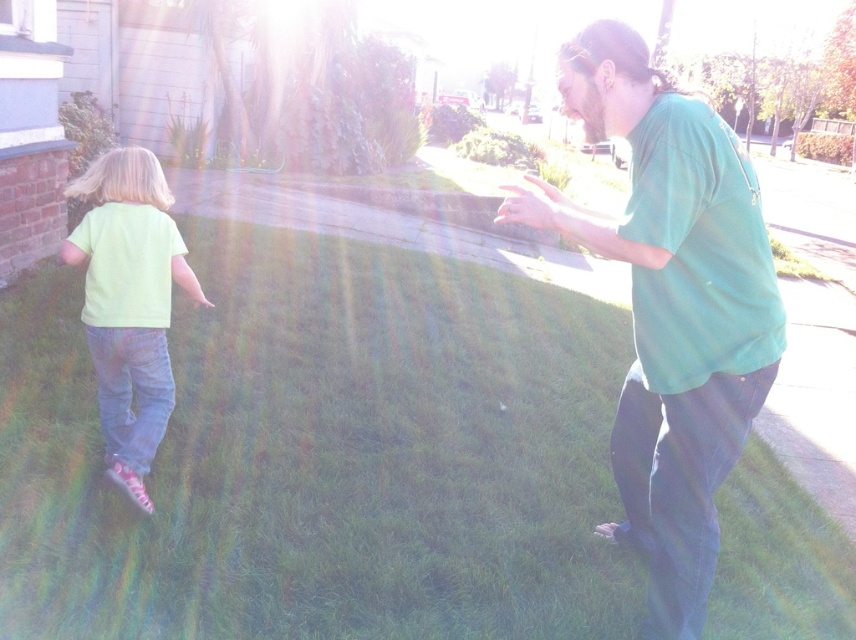
Question: Is green matte shirt at right wider than light green t-shirt at left?

Choices:
 (A) yes
 (B) no

Answer: (A)

Question: Which point is farther to the camera?

Choices:
 (A) (759, 573)
 (B) (545, 221)
 (C) (143, 452)

Answer: (A)

Question: From the image, what is the correct spatial relationship of green grass at center in relation to light green t-shirt at left?

Choices:
 (A) above
 (B) below

Answer: (B)

Question: Estimate the real-world distances between objects in this image. Which object is farther from the light green t-shirt at left?

Choices:
 (A) green grass at center
 (B) green matte shirt at right

Answer: (B)

Question: Estimate the real-world distances between objects in this image. Which object is farther from the green grass at center?

Choices:
 (A) green matte shirt at right
 (B) light green t-shirt at left

Answer: (A)

Question: Considering the relative positions of green matte shirt at right and light green t-shirt at left in the image provided, where is green matte shirt at right located with respect to light green t-shirt at left?

Choices:
 (A) below
 (B) above

Answer: (A)